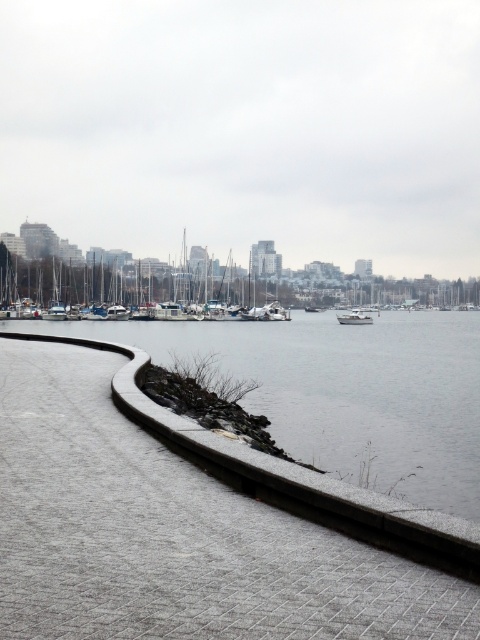
Question: Can you confirm if gray concrete water at center is thinner than white matte boat at center?

Choices:
 (A) no
 (B) yes

Answer: (A)

Question: Among these points, which one is farthest from the camera?

Choices:
 (A) (365, 316)
 (B) (408, 346)

Answer: (A)

Question: Observing the image, what is the correct spatial positioning of gray concrete water at center in reference to white matte boat at center?

Choices:
 (A) below
 (B) above

Answer: (A)

Question: Which object appears farthest from the camera in this image?

Choices:
 (A) white matte sailboat at center
 (B) gray concrete water at center

Answer: (A)

Question: Can you confirm if gray concrete water at center is wider than white matte sailboat at center?

Choices:
 (A) no
 (B) yes

Answer: (B)

Question: Based on their relative distances, which object is nearer to the gray concrete water at center?

Choices:
 (A) white matte sailboat at center
 (B) white matte boat at center

Answer: (B)